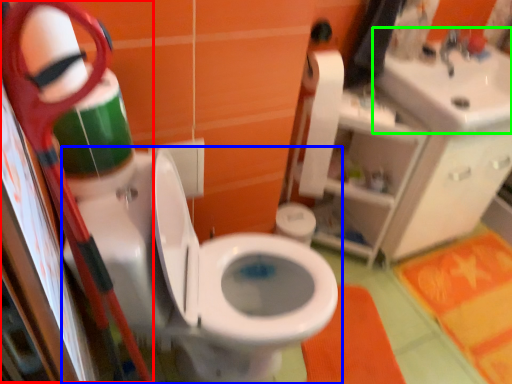
Question: Estimate the real-world distances between objects in this image. Which object is closer to scissors (highlighted by a red box), toilet (highlighted by a blue box) or sink (highlighted by a green box)?

Choices:
 (A) toilet
 (B) sink

Answer: (A)